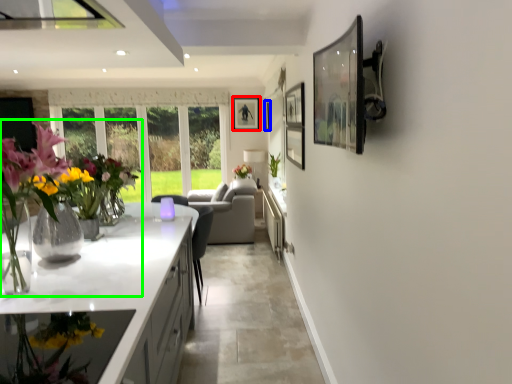
Question: Considering the real-world distances, which object is closest to picture frame (highlighted by a red box)? picture frame (highlighted by a blue box) or floral arrangement (highlighted by a green box).

Choices:
 (A) picture frame
 (B) floral arrangement

Answer: (A)